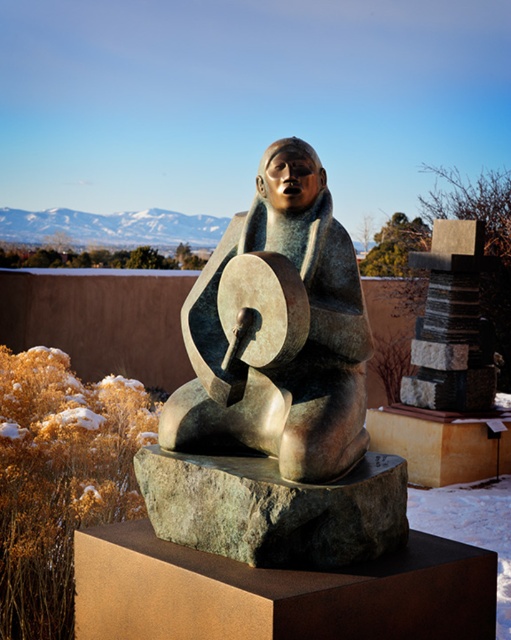
Question: Is bronze statue at center thinner than green rough stone at center?

Choices:
 (A) no
 (B) yes

Answer: (B)

Question: Which point is closer to the camera taking this photo?

Choices:
 (A) (353, 563)
 (B) (262, 451)

Answer: (A)

Question: Is bronze statue at center smaller than green rough stone at center?

Choices:
 (A) yes
 (B) no

Answer: (B)

Question: Does bronze statue at center appear under green rough stone at center?

Choices:
 (A) no
 (B) yes

Answer: (A)

Question: Which of the following is the closest to the observer?

Choices:
 (A) (335, 486)
 (B) (231, 292)

Answer: (A)